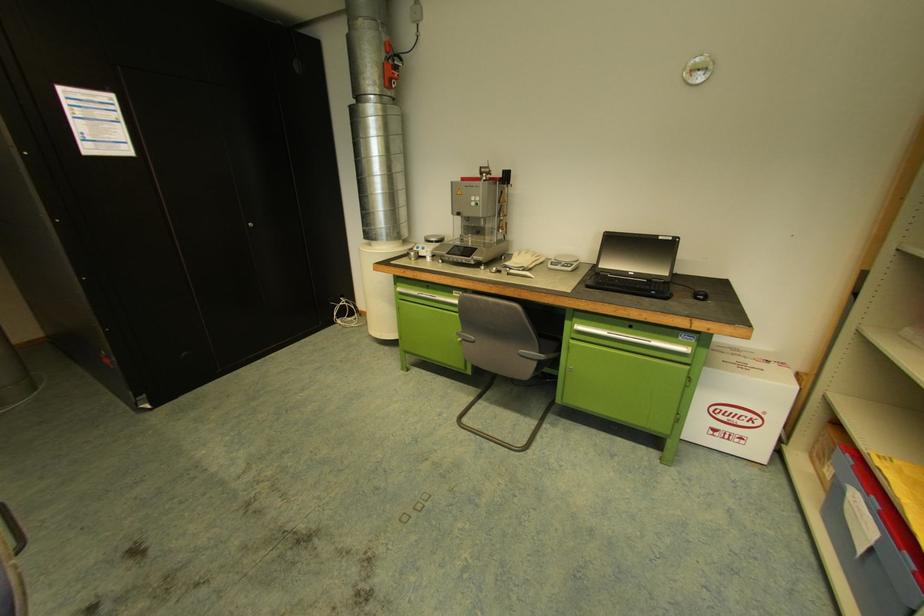
Find where to pull the machine lever. Please return your answer as a coordinate pair (x, y).

(478, 219)